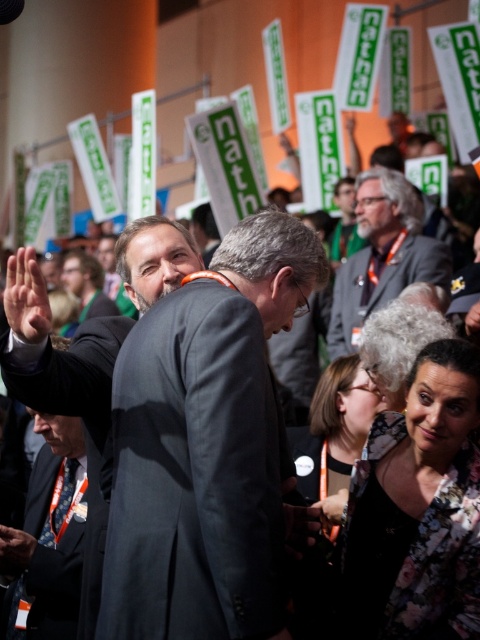
From the picture: Who is lower down, dark gray suit at center or dark gray suit at lower left?

dark gray suit at center is lower down.

Which is behind, point (189, 486) or point (15, 531)?

Positioned behind is point (15, 531).

Identify the location of dark gray suit at center. (194, 474).

Who is more forward, (4, 625) or (384, 244)?

Point (4, 625) is in front.

Which is more to the left, dark gray suit at lower left or gray hair at center?

dark gray suit at lower left

Find the location of a particular element. This screenshot has width=480, height=640. dark gray suit at lower left is located at coordinates (47, 538).

Who is positioned more to the left, dark gray suit at center or gray hair at center?

dark gray suit at center

Does dark gray suit at center have a lesser height compared to gray hair at center?

Yes.

Is point (178, 472) positioned behind point (409, 253)?

No, (178, 472) is in front of (409, 253).

At what (x,y) coordinates should I click in order to perform the action: click on dark gray suit at center. Please return your answer as a coordinate pair (x, y). Looking at the image, I should click on (194, 474).